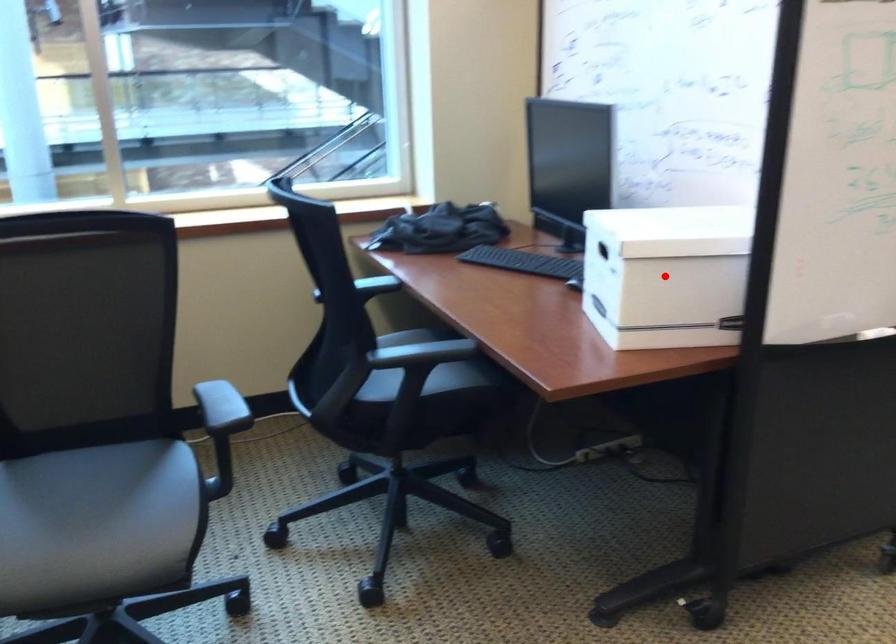
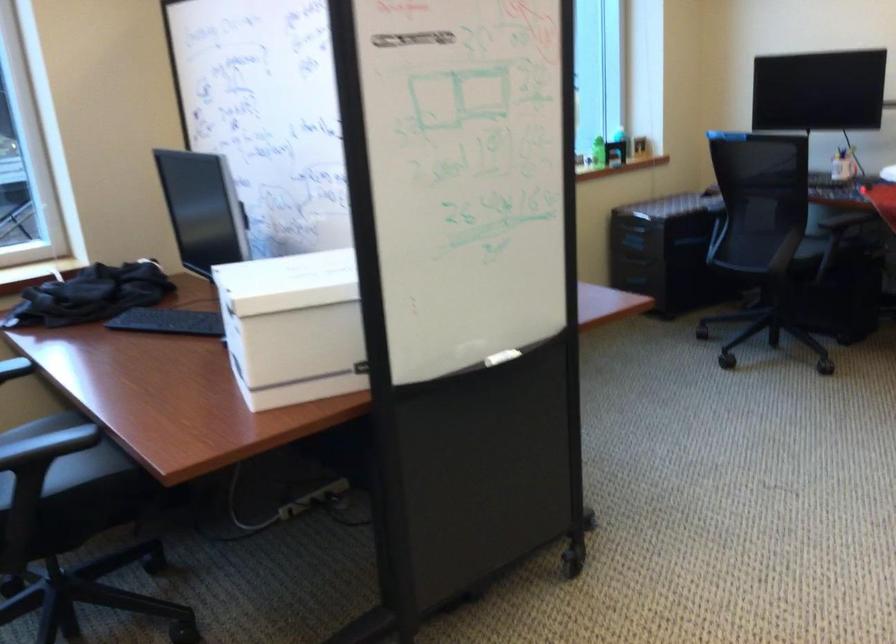
Locate, in the second image, the point that corresponds to the highlighted location in the first image.

(293, 327)